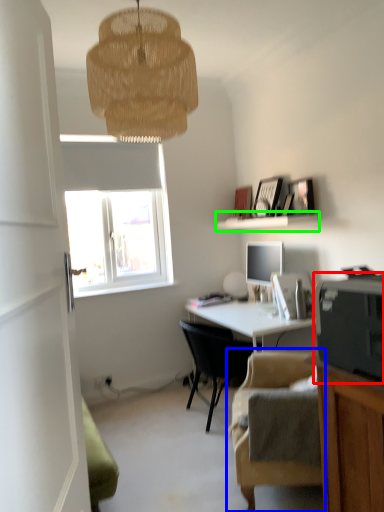
Question: Which is nearer to the printer (highlighted by a red box)? chair (highlighted by a blue box) or shelf (highlighted by a green box).

Choices:
 (A) chair
 (B) shelf

Answer: (A)